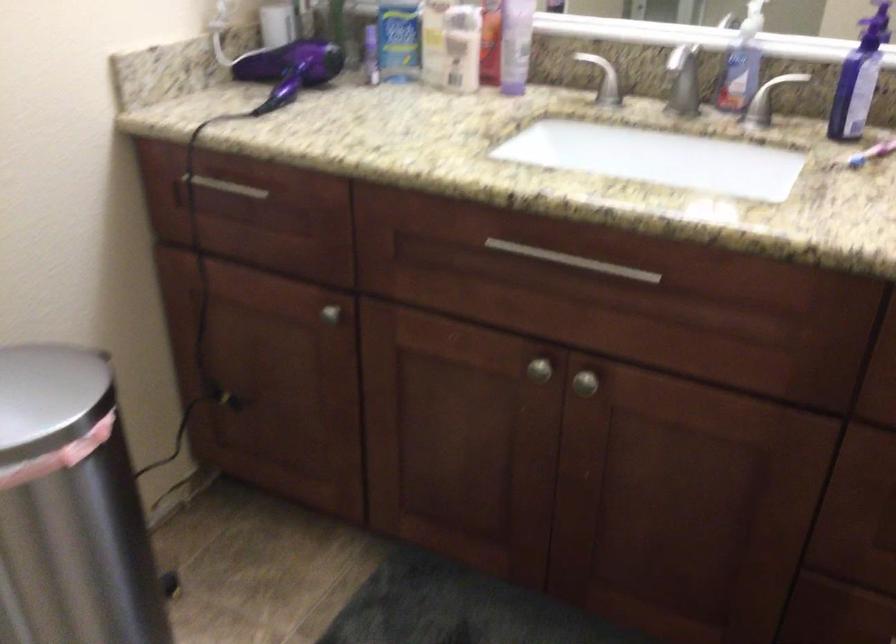
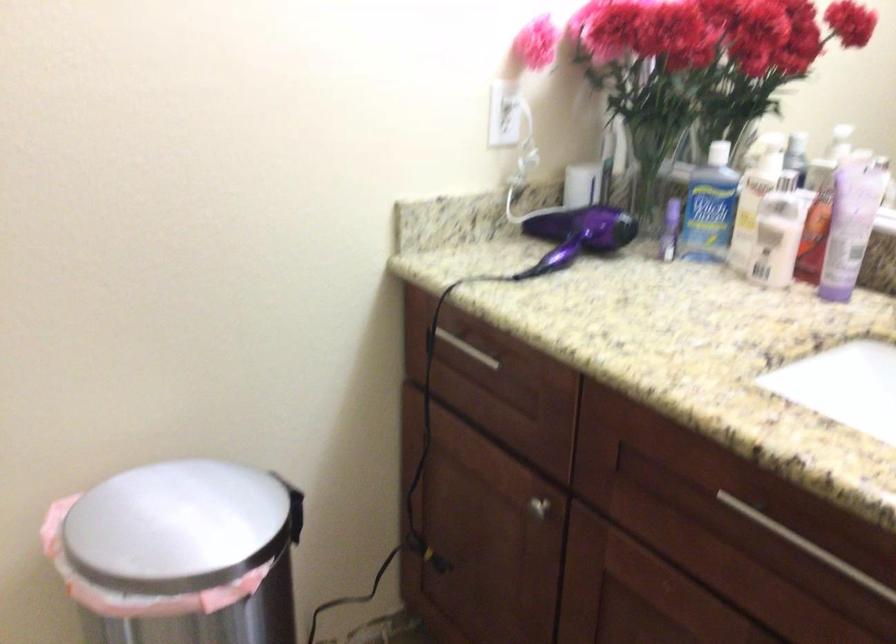
Question: How did the camera likely rotate?

Choices:
 (A) Left
 (B) Right
 (C) Up
 (D) Down

Answer: (A)